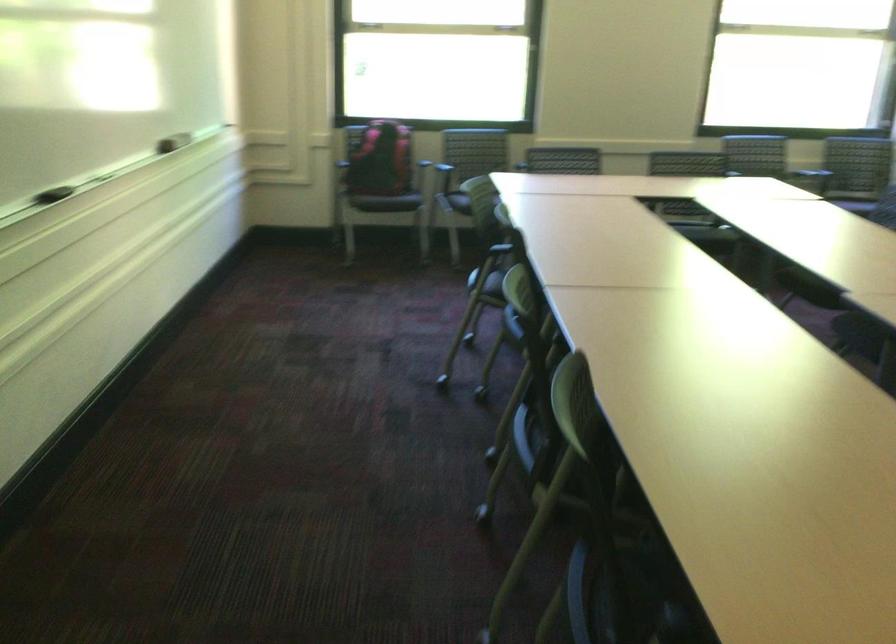
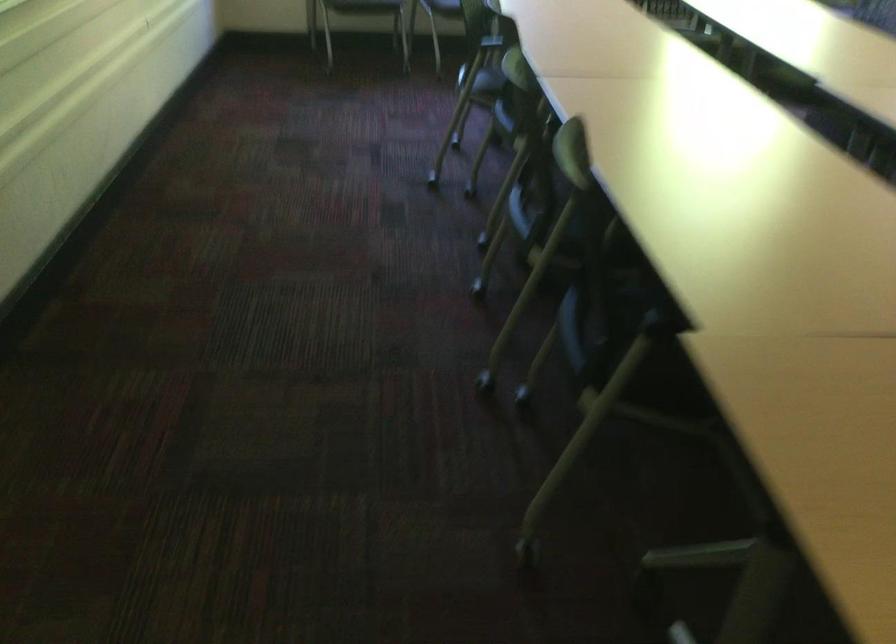
In the second image, find the point that corresponds to the point at 492,297 in the first image.

(478, 93)